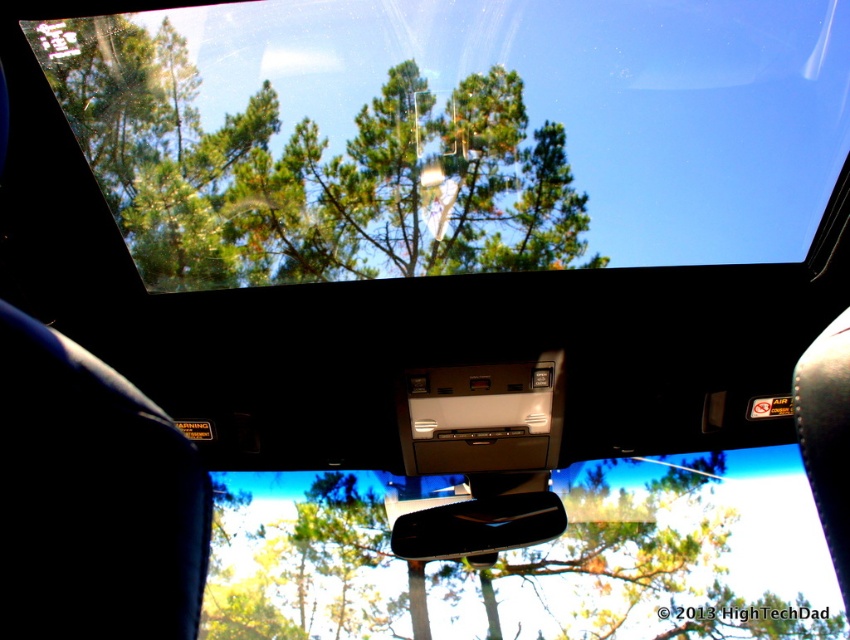
How distant is transparent glass windshield at upper center from black glossy car mirror at center?

transparent glass windshield at upper center is 1.15 meters away from black glossy car mirror at center.

Is point (428, 266) less distant than point (483, 550)?

No, it is not.

What are the coordinates of `transparent glass windshield at upper center` in the screenshot? It's located at (454, 132).

Between point (60, 80) and point (264, 609), which one is positioned behind?

The point (264, 609) is behind.

Is point (769, 200) in front of point (296, 605)?

Yes, it is in front of point (296, 605).

Is point (258, 116) more distant than point (246, 502)?

No, it is not.

Find the location of a particular element. transparent glass windshield at upper center is located at coordinates (454, 132).

Does green matte tree at center appear on the left side of black glossy car mirror at center?

Incorrect, green matte tree at center is not on the left side of black glossy car mirror at center.

Between green matte tree at center and black glossy car mirror at center, which one appears on the left side from the viewer's perspective?

Positioned to the left is black glossy car mirror at center.

Image resolution: width=850 pixels, height=640 pixels. Identify the location of green matte tree at center. pyautogui.click(x=659, y=557).

Identify the location of green matte tree at center. (659, 557).